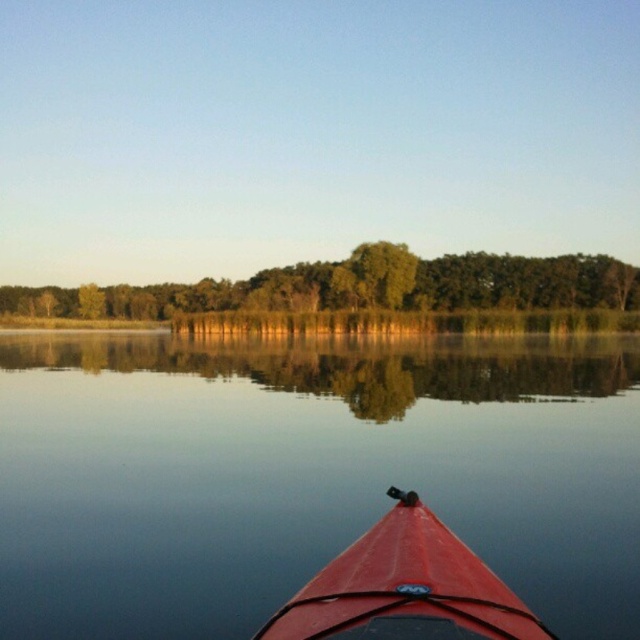
Question: Is green leafy trees at upper center positioned before green leafy tree at center?

Choices:
 (A) yes
 (B) no

Answer: (A)

Question: Among these objects, which one is nearest to the camera?

Choices:
 (A) green leafy trees at upper center
 (B) green leafy tree at center
 (C) smooth water at center
 (D) shiny red canoe at lower center

Answer: (D)

Question: Which object appears closest to the camera in this image?

Choices:
 (A) shiny red canoe at lower center
 (B) green leafy tree at center
 (C) smooth water at center

Answer: (A)

Question: Can you confirm if smooth water at center is thinner than shiny red canoe at lower center?

Choices:
 (A) yes
 (B) no

Answer: (B)

Question: Which point appears farthest from the camera in this image?

Choices:
 (A) (195, 292)
 (B) (186, 451)
 (C) (380, 602)
 (D) (396, 273)

Answer: (A)

Question: Where is shiny red canoe at lower center located in relation to green leafy tree at center in the image?

Choices:
 (A) right
 (B) left

Answer: (B)